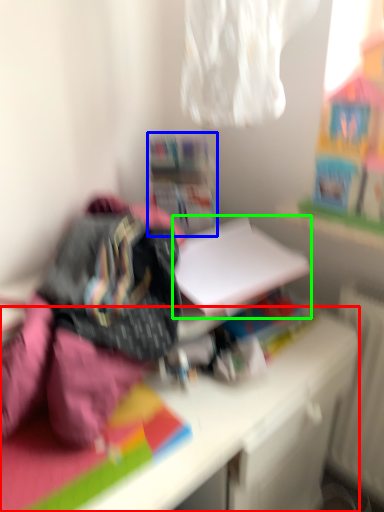
Question: Which is nearer to the desk (highlighted by a red box)? shelf (highlighted by a blue box) or paperback book (highlighted by a green box).

Choices:
 (A) shelf
 (B) paperback book

Answer: (B)